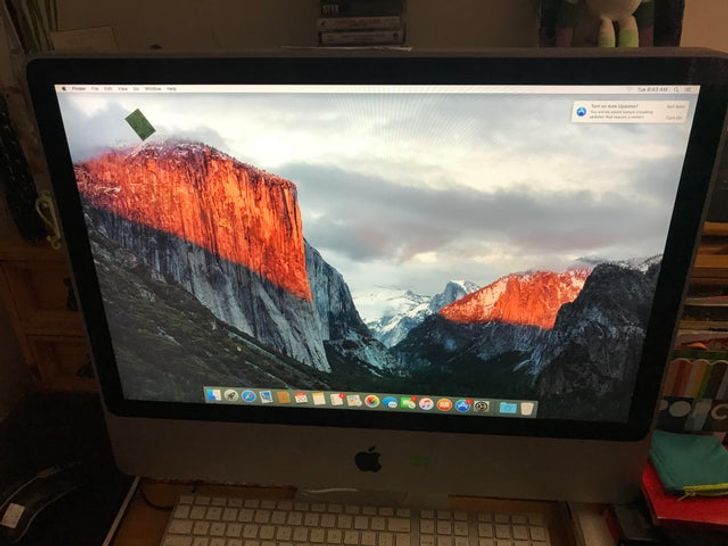
Locate an element on the screen. book holder is located at coordinates (689, 390), (707, 349), (710, 306), (713, 260).